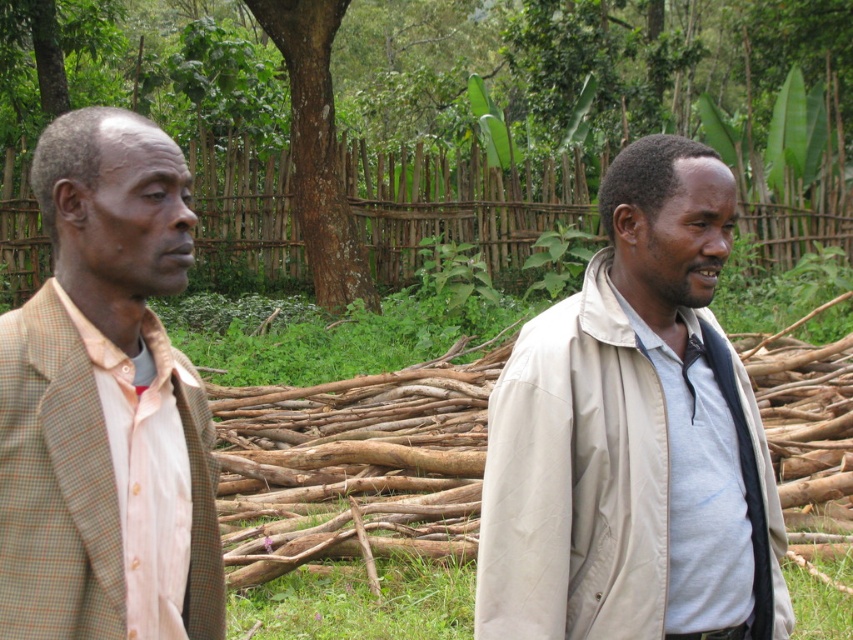
Can you confirm if brown wood tree at center is thinner than brown rough bark tree at center?

No, brown wood tree at center is not thinner than brown rough bark tree at center.

Can you confirm if brown wood tree at center is shorter than brown rough bark tree at center?

No, brown wood tree at center is not shorter than brown rough bark tree at center.

Image resolution: width=853 pixels, height=640 pixels. What do you see at coordinates (480, 125) in the screenshot?
I see `brown wood tree at center` at bounding box center [480, 125].

Where is `brown wood tree at center`? brown wood tree at center is located at coordinates (480, 125).

Does light brown checkered blazer at left appear under brown rough bark tree at center?

Indeed, light brown checkered blazer at left is positioned under brown rough bark tree at center.

Consider the image. Can you confirm if light brown checkered blazer at left is wider than brown rough bark tree at center?

No.

Which is behind, point (138, 296) or point (300, 202)?

Point (300, 202)

Where is `light brown checkered blazer at left`? The width and height of the screenshot is (853, 640). light brown checkered blazer at left is located at coordinates (100, 390).

Is point (689, 113) farther from viewer compared to point (651, 243)?

Yes, point (689, 113) is farther from viewer.

In order to click on brown wood tree at center in this screenshot , I will do `click(480, 125)`.